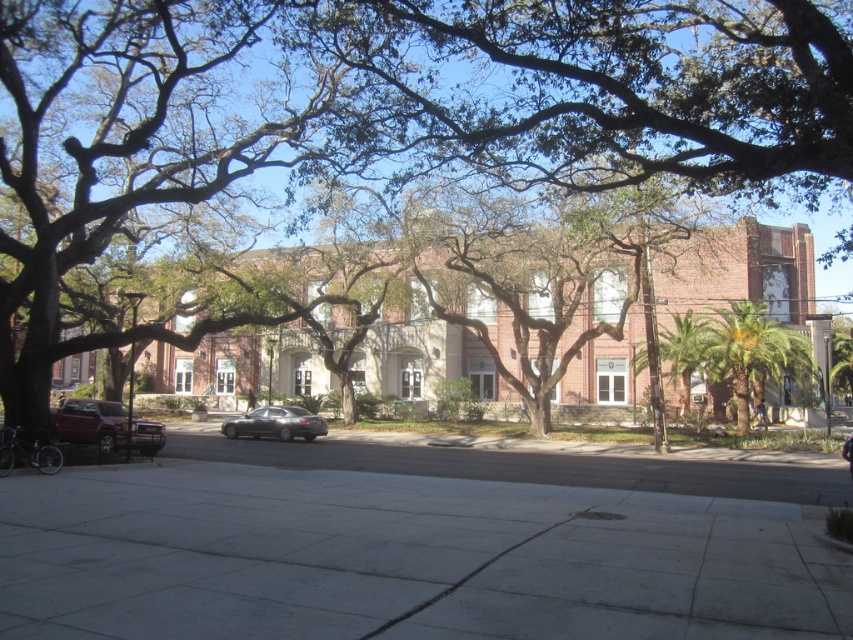
Question: Is matte red car at lower left to the left of satin black sedan at center from the viewer's perspective?

Choices:
 (A) yes
 (B) no

Answer: (A)

Question: Which point is farther from the camera taking this photo?

Choices:
 (A) (781, 68)
 (B) (276, 433)

Answer: (B)

Question: Which point is closer to the camera?

Choices:
 (A) matte red car at lower left
 (B) green leafy tree at center
 (C) gray concrete sidewalk at center
 (D) satin black sedan at center

Answer: (C)

Question: Is gray concrete sidewalk at center to the left of satin black sedan at center from the viewer's perspective?

Choices:
 (A) no
 (B) yes

Answer: (A)

Question: From the image, what is the correct spatial relationship of matte red car at lower left in relation to satin black sedan at center?

Choices:
 (A) right
 (B) left

Answer: (B)

Question: Which point is farther from the camera taking this photo?

Choices:
 (A) (268, 432)
 (B) (90, 419)
 (C) (218, 465)

Answer: (A)